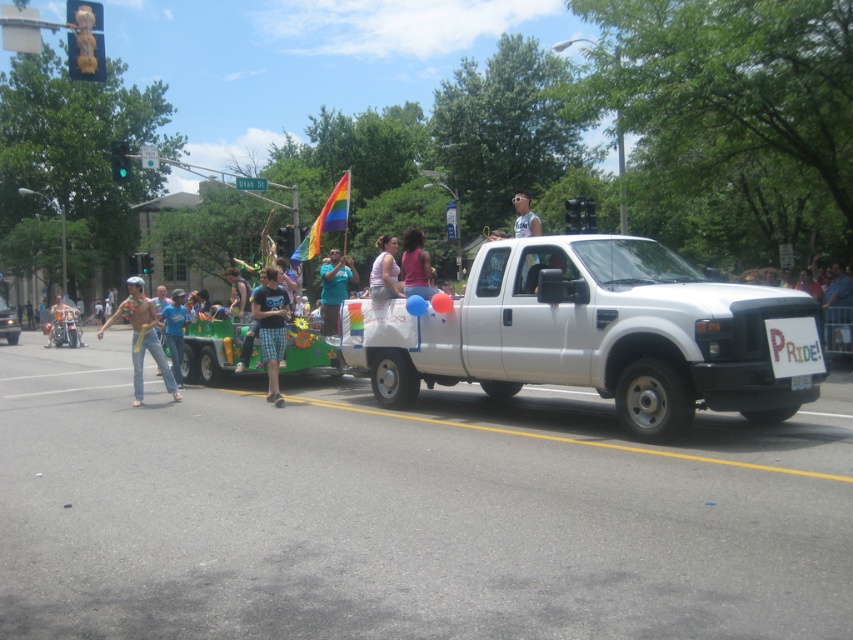
Question: Which of the following is the closest to the observer?

Choices:
 (A) (173, 369)
 (B) (331, 218)
 (C) (268, 369)

Answer: (C)

Question: Among these points, which one is nearest to the camera?

Choices:
 (A) (416, 236)
 (B) (326, 204)
 (C) (331, 298)

Answer: (A)

Question: Is rainbow fabric flag at upper center thinner than matte purple shirt at center?

Choices:
 (A) no
 (B) yes

Answer: (A)

Question: Among these objects, which one is farthest from the camera?

Choices:
 (A) rainbow fabric flag at upper center
 (B) denim jeans at left

Answer: (A)

Question: In this image, where is denim jeans at left located relative to rainbow fabric flag at upper center?

Choices:
 (A) right
 (B) left

Answer: (B)

Question: Does blue shirt at center appear on the left side of pink fabric shirt at center?

Choices:
 (A) yes
 (B) no

Answer: (A)